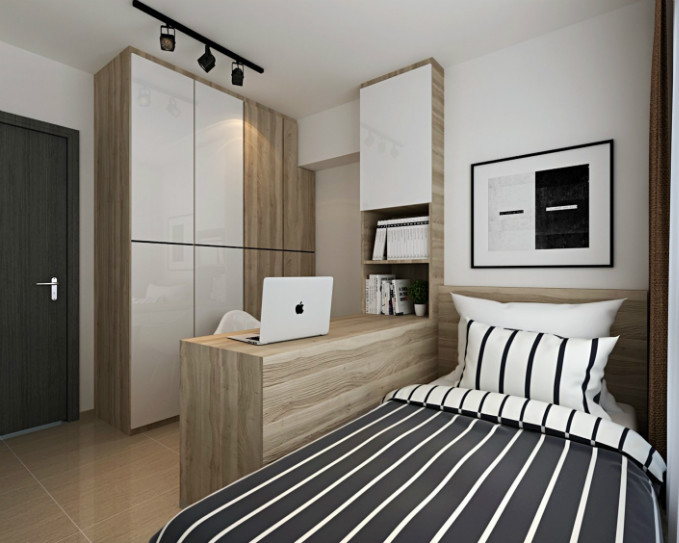
This screenshot has height=543, width=679. In order to click on door frame in this screenshot , I will do `click(52, 126)`, `click(75, 185)`.